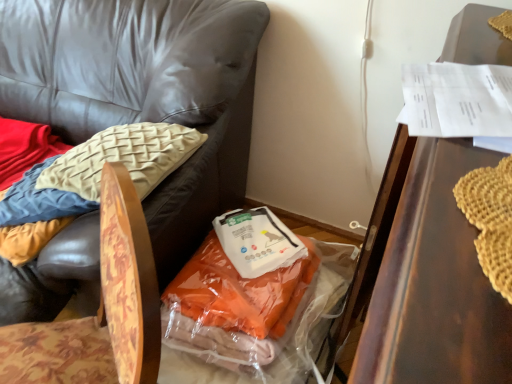
Question: Is translucent plastic bag at center next to wooden textured chair at lower left, positioned as the 2th chair in right-to-left order?

Choices:
 (A) yes
 (B) no

Answer: (B)

Question: From the image's perspective, is translucent plastic bag at center located beneath wooden textured chair at lower left, positioned as the 2th chair in right-to-left order?

Choices:
 (A) yes
 (B) no

Answer: (A)

Question: Is translucent plastic bag at center oriented towards wooden textured chair at lower left, arranged as the first chair when viewed from the left?

Choices:
 (A) yes
 (B) no

Answer: (A)

Question: Is translucent plastic bag at center not close to wooden textured chair at lower left, positioned as the 2th chair in right-to-left order?

Choices:
 (A) yes
 (B) no

Answer: (B)

Question: Is translucent plastic bag at center positioned behind wooden textured chair at lower left, arranged as the first chair when viewed from the left?

Choices:
 (A) no
 (B) yes

Answer: (B)

Question: Is translucent plastic bag at center in front of or behind floral fabric chair at lower left, which is counted as the 1th chair, starting from the right, in the image?

Choices:
 (A) behind
 (B) front

Answer: (A)

Question: Does point (228, 213) appear closer or farther from the camera than point (6, 369)?

Choices:
 (A) farther
 (B) closer

Answer: (A)

Question: Based on their sizes in the image, would you say translucent plastic bag at center is bigger or smaller than floral fabric chair at lower left, the second chair positioned from the left?

Choices:
 (A) small
 (B) big

Answer: (A)

Question: Based on their positions, is translucent plastic bag at center located to the left or right of floral fabric chair at lower left, the second chair positioned from the left?

Choices:
 (A) left
 (B) right

Answer: (B)

Question: From the image's perspective, relative to translucent plastic bag at center, is floral fabric chair at lower left, which is counted as the 1th chair, starting from the right, above or below?

Choices:
 (A) above
 (B) below

Answer: (B)

Question: Considering their positions, is floral fabric chair at lower left, which is counted as the 1th chair, starting from the right, located in front of or behind translucent plastic bag at center?

Choices:
 (A) front
 (B) behind

Answer: (A)

Question: Based on their sizes in the image, would you say floral fabric chair at lower left, the second chair positioned from the left, is bigger or smaller than translucent plastic bag at center?

Choices:
 (A) big
 (B) small

Answer: (A)

Question: From their relative heights in the image, would you say floral fabric chair at lower left, the second chair positioned from the left, is taller or shorter than translucent plastic bag at center?

Choices:
 (A) short
 (B) tall

Answer: (B)

Question: In terms of width, does translucent plastic bag at center look wider or thinner when compared to floral fabric chair at lower left, which is counted as the 1th chair, starting from the right?

Choices:
 (A) thin
 (B) wide

Answer: (A)

Question: Choose the correct answer: Is translucent plastic bag at center inside floral fabric chair at lower left, which is counted as the 1th chair, starting from the right, or outside it?

Choices:
 (A) outside
 (B) inside

Answer: (A)